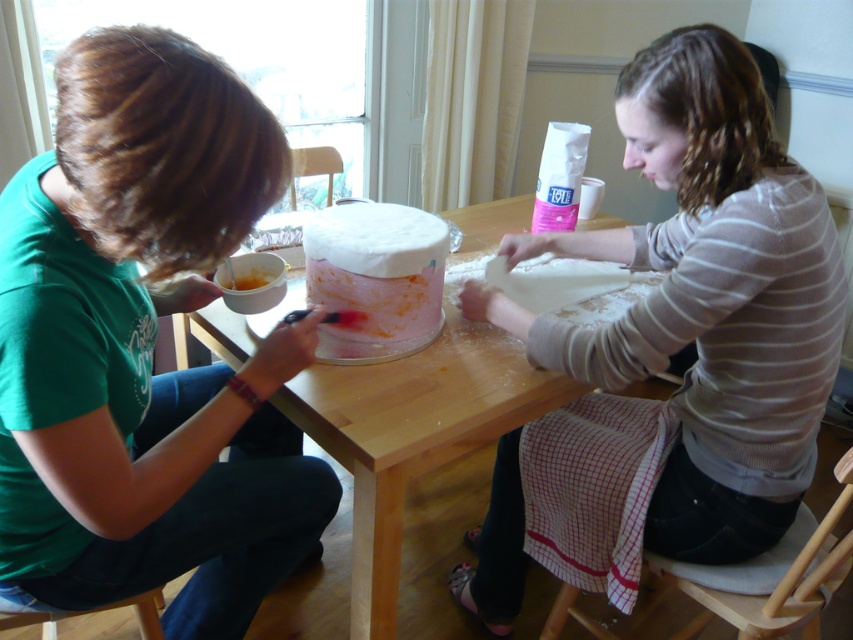
What are the coordinates of the green matte shirt at left in the image?

The green matte shirt at left is located at coordinates point (144, 348).

You are standing in front of the baking table. Which object is nearer to you, the green matte shirt at left or the orange smoothie at center?

The green matte shirt at left is closer to the viewer than the orange smoothie at center.

You are a delivery robot that is 0.8 meters wide. You need to deliver a cake to the wooden table at center. Can you fit through the space between the two people and the table?

The wooden table at center and camera are 1.02 meters apart. Since the robot is 0.8 meters wide, it can fit through the space as 1.02 meters is wider than the robot.